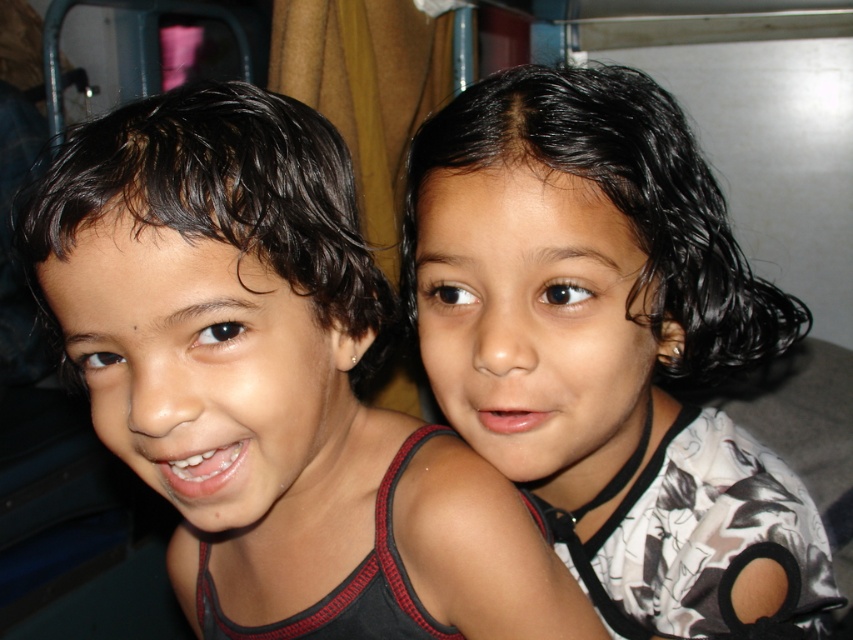
Question: Which point appears farthest from the camera in this image?

Choices:
 (A) (x=552, y=164)
 (B) (x=268, y=436)

Answer: (A)

Question: Can you confirm if matte black tank top at left is positioned to the left of black matte hair at upper right?

Choices:
 (A) no
 (B) yes

Answer: (B)

Question: Does matte black tank top at left appear under black matte hair at upper right?

Choices:
 (A) no
 (B) yes

Answer: (B)

Question: Does matte black tank top at left appear on the left side of black matte hair at upper right?

Choices:
 (A) yes
 (B) no

Answer: (A)